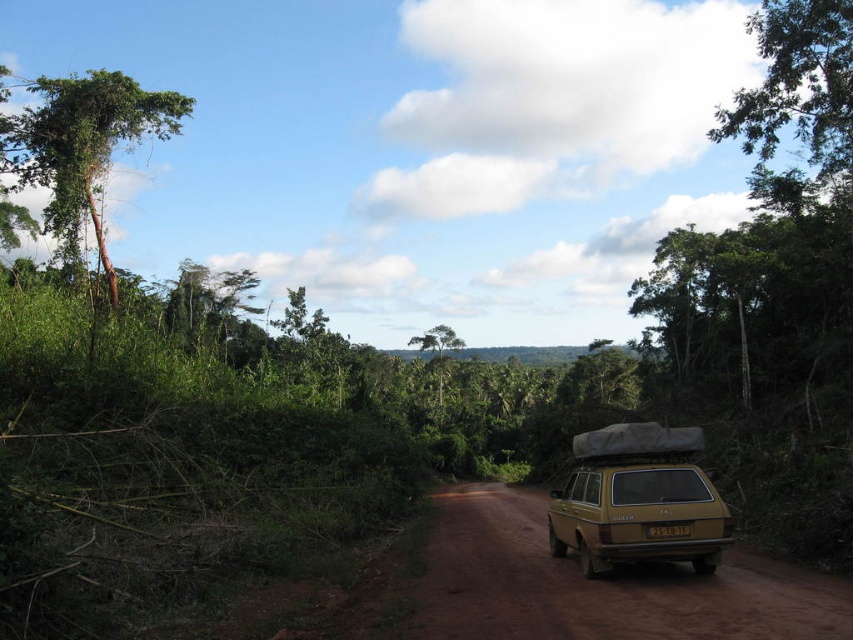
You are a hiker planning to walk along the brown dirt track at center and pass by the green leafy tree at center. Which object will appear larger in your view as you approach them?

The green leafy tree at center will appear larger in your view as you approach them because it is larger than the brown dirt track at center.

You are a hiker who wants to walk along the brown dirt track at center. You notice a green leafy tree at center nearby. Which side of the tree should you look towards to find the dirt track?

The brown dirt track at center is positioned on the right side of the green leafy tree at center, so you should look to the right side of the tree to find the dirt track.